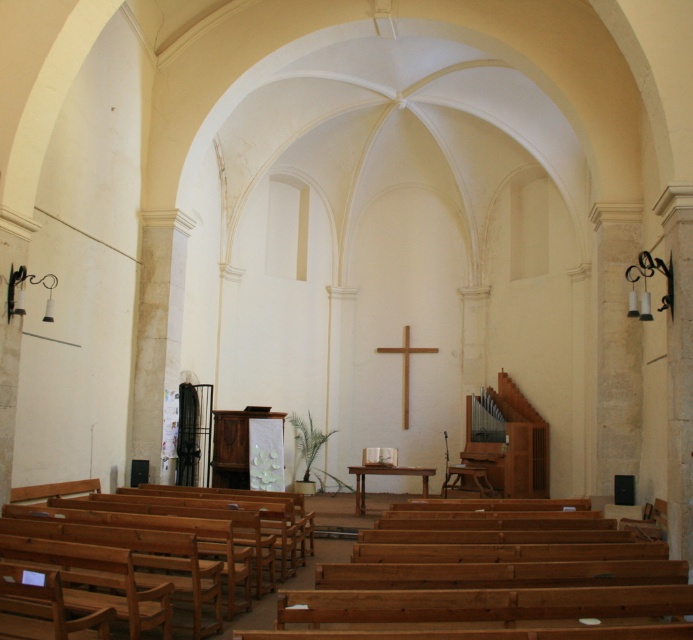
Where is `wooden polished table at center`? The height and width of the screenshot is (640, 693). wooden polished table at center is located at coordinates (387, 474).

Can you confirm if wooden polished table at center is bigger than wooden cross at center?

Yes, wooden polished table at center is bigger than wooden cross at center.

Which is behind, point (360, 472) or point (403, 381)?

Positioned behind is point (403, 381).

This screenshot has width=693, height=640. What are the coordinates of `wooden polished table at center` in the screenshot? It's located at (387, 474).

Does natural wood church bench at lower left have a lesser width compared to wooden cross at center?

No, natural wood church bench at lower left is not thinner than wooden cross at center.

Who is positioned more to the left, natural wood church bench at lower left or wooden cross at center?

Positioned to the left is natural wood church bench at lower left.

Who is more forward, (299, 502) or (405, 344)?

Point (299, 502) is more forward.

Locate an element on the screen. The image size is (693, 640). natural wood church bench at lower left is located at coordinates (179, 515).

The image size is (693, 640). What are the coordinates of `natural wood church bench at lower left` in the screenshot? It's located at (179, 515).

Is natural wood church bench at lower left thinner than wooden polished table at center?

A: In fact, natural wood church bench at lower left might be wider than wooden polished table at center.

Is point (28, 513) more distant than point (351, 470)?

No, (28, 513) is closer to viewer.

What are the coordinates of `natural wood church bench at lower left` in the screenshot? It's located at (179, 515).